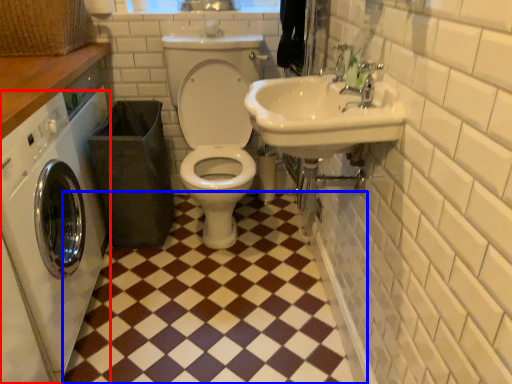
Question: Which object is closer to the camera taking this photo, washing machine (highlighted by a red box) or ceramic tile (highlighted by a blue box)?

Choices:
 (A) washing machine
 (B) ceramic tile

Answer: (A)